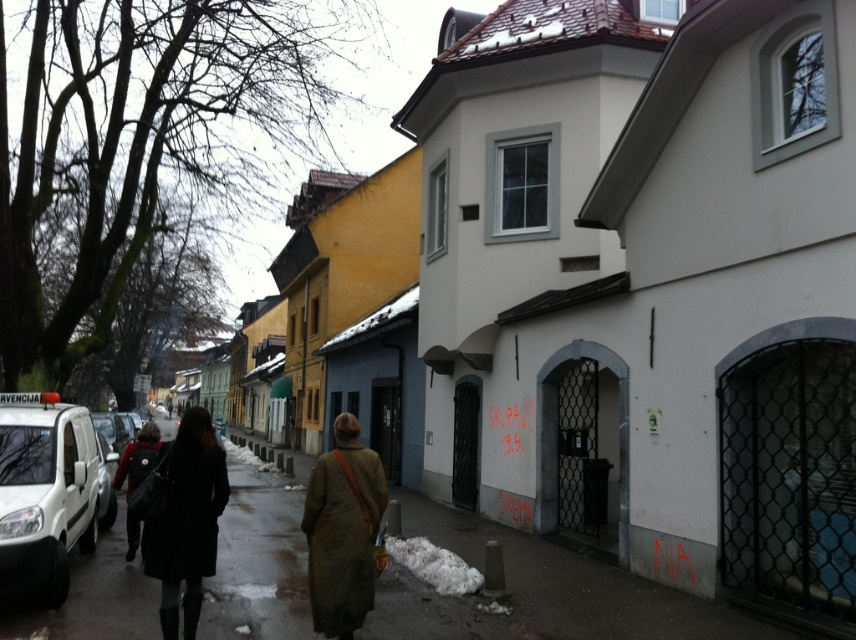
Find the location of a particular element. smooth asphalt sidewalk at lower center is located at coordinates (539, 593).

Who is more forward, [15,634] or [352,541]?

Positioned in front is point [352,541].

Where is `smooth asphalt sidewalk at lower center`? The width and height of the screenshot is (856, 640). smooth asphalt sidewalk at lower center is located at coordinates (539, 593).

Who is more forward, [80,524] or [150,444]?

Positioned in front is point [80,524].

You are a GUI agent. You are given a task and a screenshot of the screen. Output one action in this format:
    pyautogui.click(x=<x>, y=<y>)
    Task: Click on the white matte van at left
    
    Given the screenshot: What is the action you would take?
    pyautogui.click(x=45, y=492)

Image resolution: width=856 pixels, height=640 pixels. I want to click on white matte van at left, so click(45, 492).

Which of these two, white matte van at left or white glossy van at left, stands taller?

Standing taller between the two is white glossy van at left.

Does point (21, 401) come closer to viewer compared to point (119, 424)?

Yes.

Identify the location of white matte van at left. This screenshot has width=856, height=640. (45, 492).